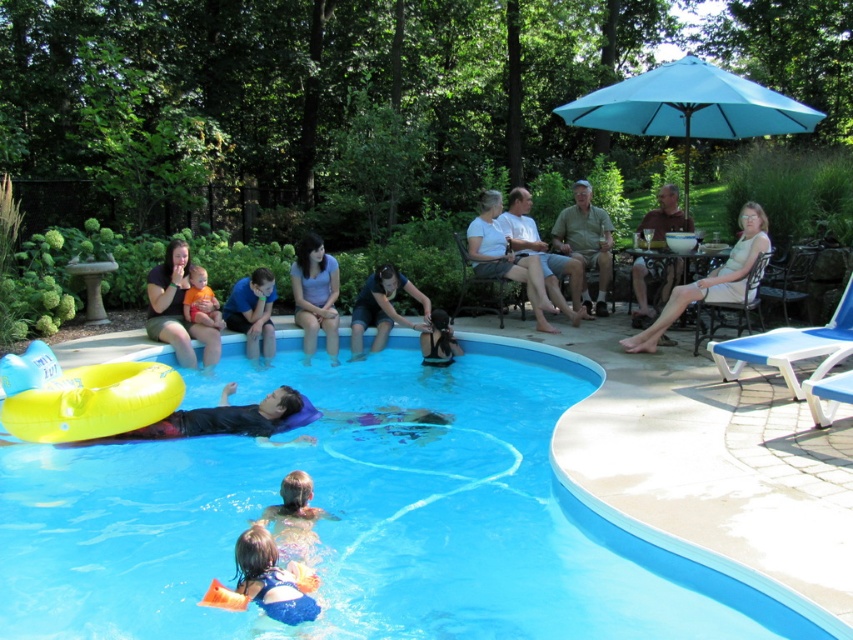
You are a photographer standing at the edge of the pool. You want to capture a photo of the light brown hair at lower center. Based on its 2D coordinates, where should you position your camera to ensure it is centered in the frame?

To center the light brown hair at lower center in the frame, position your camera so that it aligns with the coordinates point (294, 515).

You are a photographer standing at the center of the pool. You want to take a photo that includes both the matte black shirt at upper left and the brown fabric chair at upper right. Given that your camera has a maximum angle of view of 120 degrees, can you capture both objects in a single shot without moving?

The matte black shirt at upper left is 14.46 feet away from the brown fabric chair at upper right. To determine if they can fit in a 120 degree angle, we need to calculate the distance between them relative to the camera position. Since the photographer is at the center of the pool, the objects are positioned at opposite ends. The angular separation between them would likely exceed 120 degrees, making it impossible to capture both in one shot without moving.